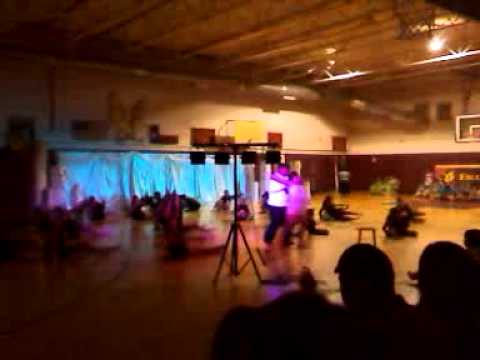
You are a GUI agent. You are given a task and a screenshot of the screen. Output one action in this format:
    pyautogui.click(x=<x>, y=<y>)
    Task: Click on the ceiling light
    The width and height of the screenshot is (480, 360).
    Given the screenshot: What is the action you would take?
    pyautogui.click(x=435, y=45)